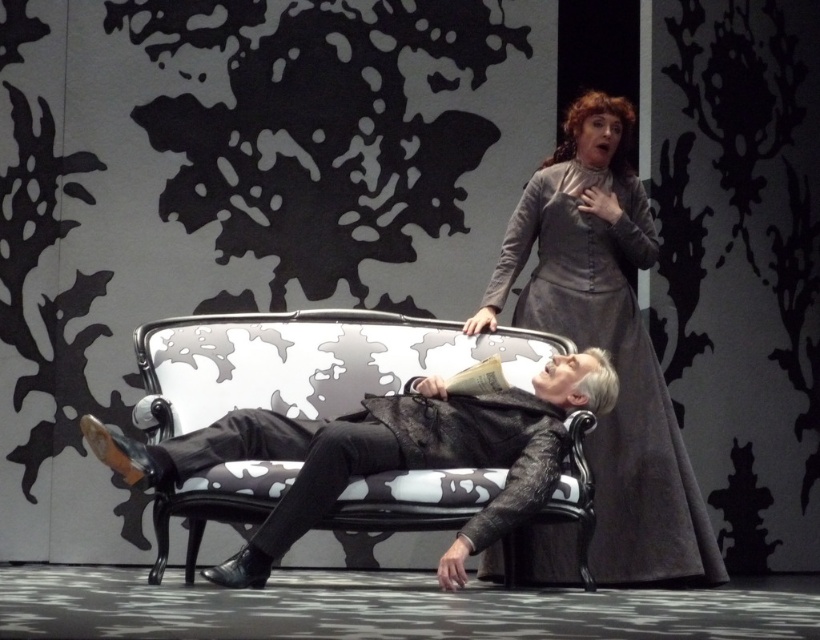
You are a stagehand in a theater and need to locate the gray wool dress at upper right for the next scene. According to the coordinates provided, where exactly should you look on the stage?

The gray wool dress at upper right is located at point (616, 371) on the stage.

You are an actor preparing for a play and need to decide which costume to wear. You see the gray wool dress at upper right and the leather jacket at center in the scene. Which costume is placed higher up in the image?

The gray wool dress at upper right is positioned over the leather jacket at center, meaning it is placed higher up in the image.

You are a costume designer reviewing the stage setup. You notice the leather jacket at center and the black leather pants at center. Which piece of clothing is positioned to the right in this theatrical scene?

The leather jacket at center is to the right of the black leather pants at center, so the leather jacket at center is positioned to the right.